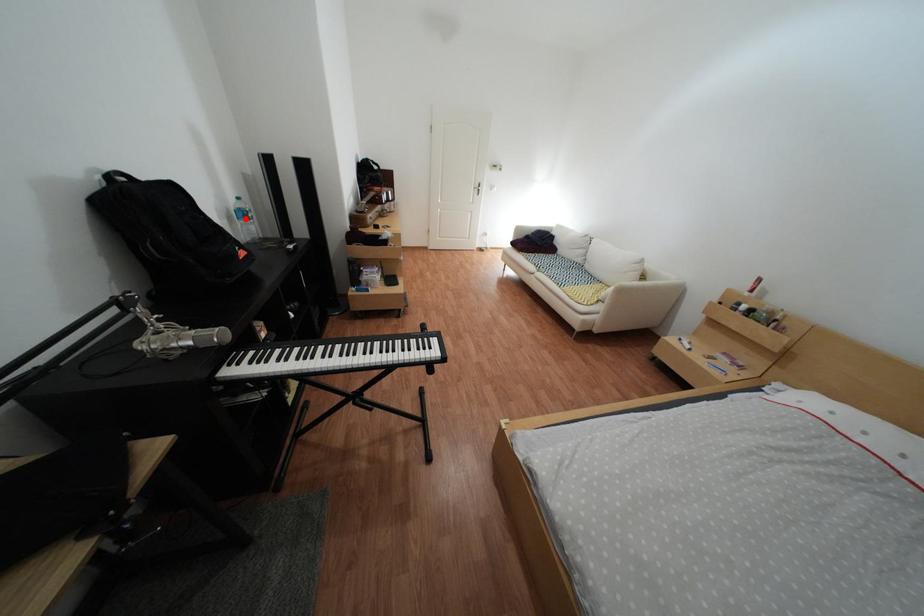
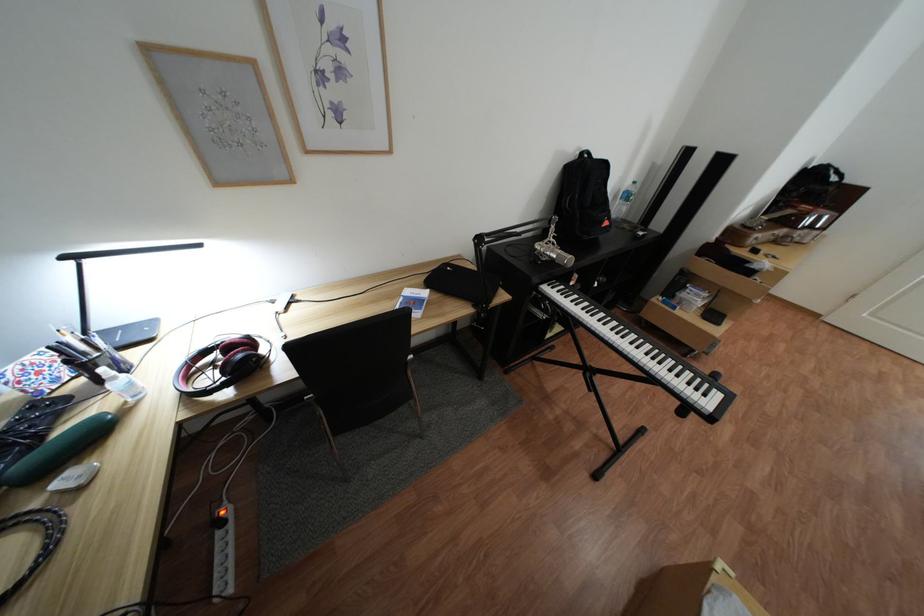
Question: I am providing you with two images of the same scene from different viewpoints. A red point is shown in image1. For the corresponding object point in image2, is it positioned nearer or farther from the camera?

Choices:
 (A) Nearer
 (B) Farther

Answer: (B)